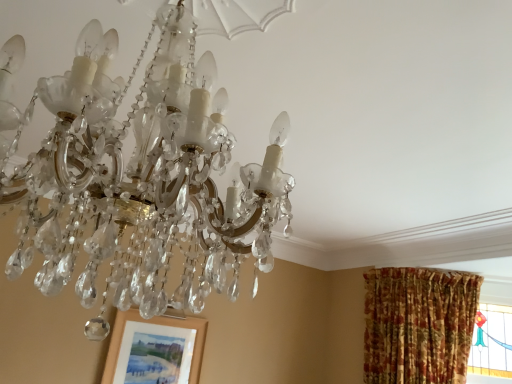
The width and height of the screenshot is (512, 384). Describe the element at coordinates (139, 177) in the screenshot. I see `clear crystal chandelier at upper center` at that location.

Measure the distance between point (148, 233) and camera.

Point (148, 233) and camera are 72.40 centimeters apart.

Measure the distance between clear crystal chandelier at upper center and camera.

clear crystal chandelier at upper center and camera are 22.64 inches apart.

Locate an element on the screen. The height and width of the screenshot is (384, 512). clear crystal chandelier at upper center is located at coordinates (139, 177).

The height and width of the screenshot is (384, 512). What do you see at coordinates (155, 349) in the screenshot? I see `matte wooden picture frame at lower left` at bounding box center [155, 349].

Locate an element on the screen. This screenshot has width=512, height=384. matte wooden picture frame at lower left is located at coordinates (155, 349).

Image resolution: width=512 pixels, height=384 pixels. In order to click on clear crystal chandelier at upper center in this screenshot , I will do `click(139, 177)`.

Can you confirm if matte wooden picture frame at lower left is positioned to the left of clear crystal chandelier at upper center?

Yes, matte wooden picture frame at lower left is to the left of clear crystal chandelier at upper center.

Which is in front, matte wooden picture frame at lower left or clear crystal chandelier at upper center?

Positioned in front is clear crystal chandelier at upper center.

Does point (124, 381) lie in front of point (203, 287)?

No, (124, 381) is behind (203, 287).

From the image's perspective, between matte wooden picture frame at lower left and clear crystal chandelier at upper center, who is located below?

matte wooden picture frame at lower left is shown below in the image.

From a real-world perspective, is matte wooden picture frame at lower left physically located above or below clear crystal chandelier at upper center?

matte wooden picture frame at lower left is situated lower than clear crystal chandelier at upper center in the real world.

Looking at their sizes, would you say matte wooden picture frame at lower left is wider or thinner than clear crystal chandelier at upper center?

Considering their sizes, matte wooden picture frame at lower left looks slimmer than clear crystal chandelier at upper center.

Between matte wooden picture frame at lower left and clear crystal chandelier at upper center, which one has more height?

clear crystal chandelier at upper center.

Who is bigger, matte wooden picture frame at lower left or clear crystal chandelier at upper center?

Bigger between the two is clear crystal chandelier at upper center.

Is matte wooden picture frame at lower left positioned beyond the bounds of clear crystal chandelier at upper center?

Absolutely, matte wooden picture frame at lower left is external to clear crystal chandelier at upper center.

Is matte wooden picture frame at lower left far from clear crystal chandelier at upper center?

Yes.

Is clear crystal chandelier at upper center at the back of matte wooden picture frame at lower left?

That's not correct — matte wooden picture frame at lower left is not looking away from clear crystal chandelier at upper center.

How different are the orientations of matte wooden picture frame at lower left and clear crystal chandelier at upper center in degrees?

They differ by 176 degrees in their facing directions.

The image size is (512, 384). I want to click on picture frame that is behind the clear crystal chandelier at upper center, so click(x=155, y=349).

Is clear crystal chandelier at upper center at the right side of matte wooden picture frame at lower left?

Yes, clear crystal chandelier at upper center is to the right of matte wooden picture frame at lower left.

Considering the relative positions of clear crystal chandelier at upper center and matte wooden picture frame at lower left in the image provided, is clear crystal chandelier at upper center behind matte wooden picture frame at lower left?

No, clear crystal chandelier at upper center is in front of matte wooden picture frame at lower left.

Which point is more distant from viewer, (85, 191) or (156, 359)?

The point (156, 359) is farther.

Looking at this image, from the image's perspective, does clear crystal chandelier at upper center appear lower than matte wooden picture frame at lower left?

No.

From a real-world perspective, which is physically above, clear crystal chandelier at upper center or matte wooden picture frame at lower left?

From a 3D spatial view, clear crystal chandelier at upper center is above.

Does clear crystal chandelier at upper center have a lesser width compared to matte wooden picture frame at lower left?

Incorrect, the width of clear crystal chandelier at upper center is not less than that of matte wooden picture frame at lower left.

Does clear crystal chandelier at upper center have a greater height compared to matte wooden picture frame at lower left?

Correct, clear crystal chandelier at upper center is much taller as matte wooden picture frame at lower left.

Can you confirm if clear crystal chandelier at upper center is bigger than matte wooden picture frame at lower left?

Yes.

Is clear crystal chandelier at upper center positioned beyond the bounds of matte wooden picture frame at lower left?

clear crystal chandelier at upper center is positioned outside matte wooden picture frame at lower left.

Is clear crystal chandelier at upper center placed right next to matte wooden picture frame at lower left?

No, clear crystal chandelier at upper center is not next to matte wooden picture frame at lower left.

Is matte wooden picture frame at lower left at the back of clear crystal chandelier at upper center?

No, matte wooden picture frame at lower left is not at the back of clear crystal chandelier at upper center.

The width and height of the screenshot is (512, 384). I want to click on lamp that appears in front of the matte wooden picture frame at lower left, so click(x=139, y=177).

Where is `lamp that is in front of the matte wooden picture frame at lower left`? The width and height of the screenshot is (512, 384). lamp that is in front of the matte wooden picture frame at lower left is located at coordinates (139, 177).

Find the location of a particular element. The image size is (512, 384). lamp located above the matte wooden picture frame at lower left (from a real-world perspective) is located at coordinates (139, 177).